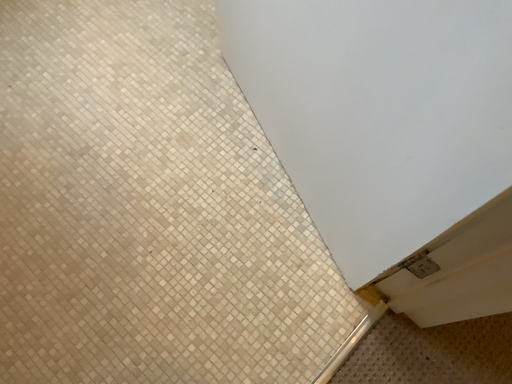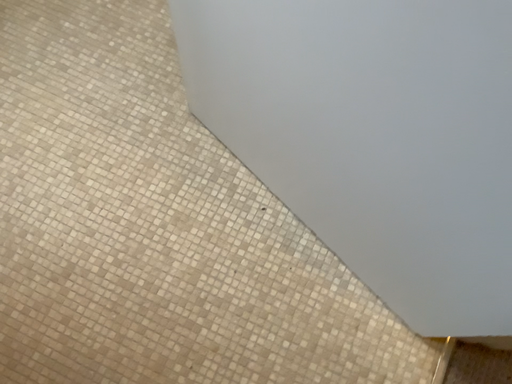
Question: How did the camera likely rotate when shooting the video?

Choices:
 (A) rotated right
 (B) rotated left

Answer: (A)